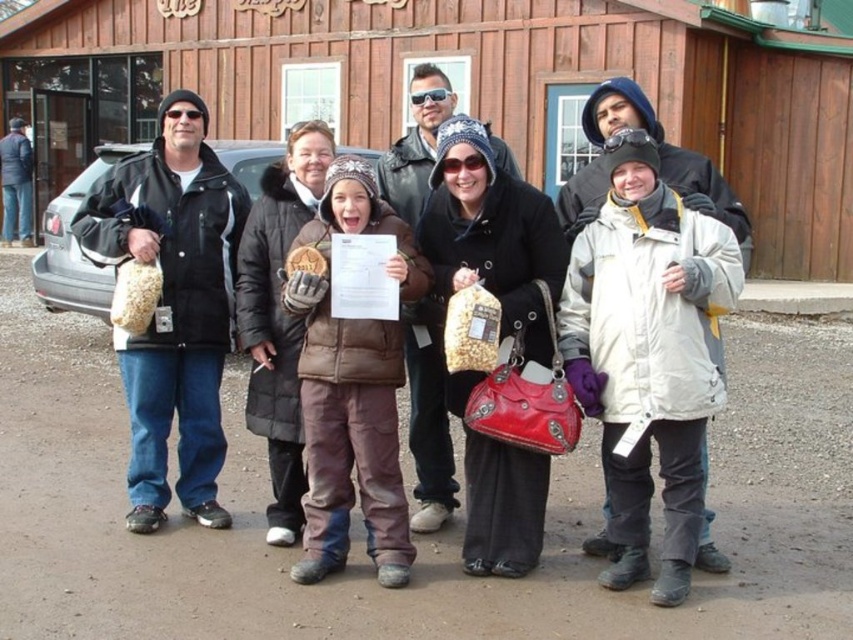
Question: Which object is positioned farthest from the brown fuzzy jacket at center?

Choices:
 (A) matte black jacket at left
 (B) wooden hut at center

Answer: (B)

Question: Can you confirm if wooden hut at center is positioned to the right of matte black jacket at left?

Choices:
 (A) no
 (B) yes

Answer: (B)

Question: Which object is positioned closest to the wooden hut at center?

Choices:
 (A) brown fuzzy jacket at center
 (B) matte black jacket at left

Answer: (A)

Question: In this image, where is wooden hut at center located relative to brown fuzzy jacket at center?

Choices:
 (A) left
 (B) right

Answer: (A)

Question: Which point is closer to the camera?

Choices:
 (A) brown fuzzy jacket at center
 (B) matte black jacket at left
 (C) wooden hut at center

Answer: (A)

Question: Is wooden hut at center to the right of brown fuzzy jacket at center from the viewer's perspective?

Choices:
 (A) no
 (B) yes

Answer: (A)